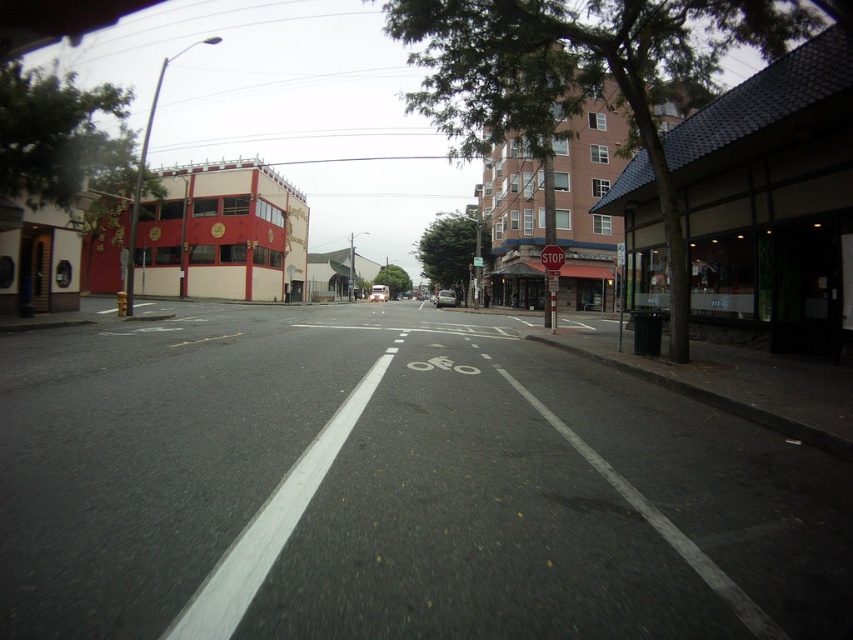
Does metallic silver car at center have a lesser height compared to metallic silver van at center?

Yes.

Does metallic silver car at center have a lesser width compared to metallic silver van at center?

Indeed, metallic silver car at center has a lesser width compared to metallic silver van at center.

Find the location of a particular element. metallic silver car at center is located at coordinates (445, 298).

I want to click on metallic silver car at center, so click(445, 298).

Does black asphalt road at center have a lesser height compared to red matte building at left?

Indeed, black asphalt road at center has a lesser height compared to red matte building at left.

Which is below, black asphalt road at center or red matte building at left?

black asphalt road at center is below.

Find the location of a particular element. black asphalt road at center is located at coordinates (393, 490).

In the scene shown: How much distance is there between red plastic stop sign at center and metallic silver car at center?

They are 33.10 meters apart.

Is point (553, 307) more distant than point (450, 305)?

That is False.

Between point (555, 269) and point (442, 292), which one is positioned in front?

Point (555, 269) is more forward.

Where is `red plastic stop sign at center`? Image resolution: width=853 pixels, height=640 pixels. red plastic stop sign at center is located at coordinates (550, 278).